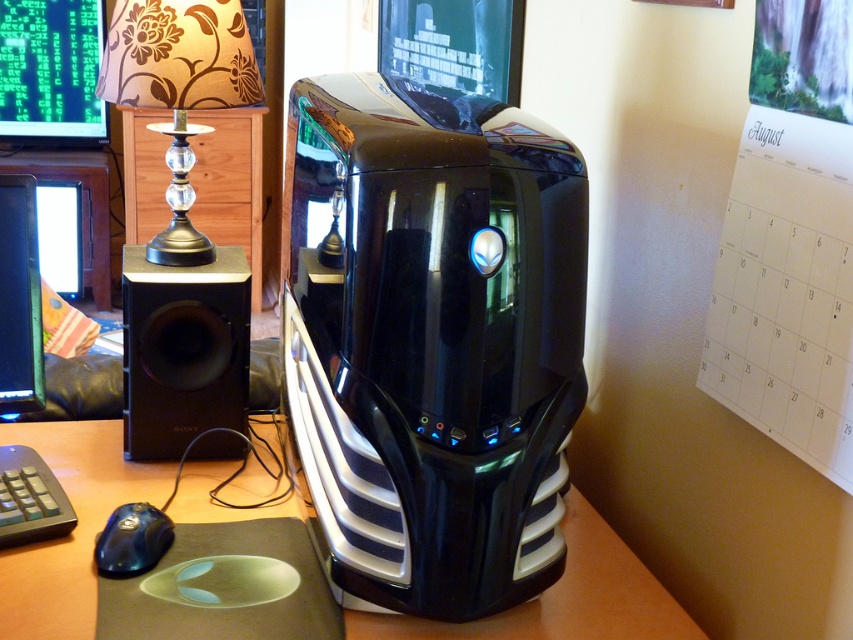
Which of these two, white paper calendar at upper right or black rubberized keyboard at lower left, stands shorter?

Standing shorter between the two is black rubberized keyboard at lower left.

Can you confirm if white paper calendar at upper right is positioned below black rubberized keyboard at lower left?

No.

Is point (747, 109) farther from viewer compared to point (47, 502)?

No, it is not.

Identify the location of white paper calendar at upper right. (786, 289).

Who is positioned more to the left, white paper calendar at upper right or blue glossy mouse at lower left?

Positioned to the left is blue glossy mouse at lower left.

This screenshot has width=853, height=640. Describe the element at coordinates (786, 289) in the screenshot. I see `white paper calendar at upper right` at that location.

Measure the distance between white paper calendar at upper right and camera.

white paper calendar at upper right and camera are 89.13 centimeters apart from each other.

You are a GUI agent. You are given a task and a screenshot of the screen. Output one action in this format:
    pyautogui.click(x=<x>, y=<y>)
    Task: Click on the white paper calendar at upper right
    This screenshot has width=853, height=640.
    Given the screenshot: What is the action you would take?
    pyautogui.click(x=786, y=289)

Which is in front, point (578, 230) or point (161, 390)?

Point (578, 230)

Between glossy black desktop at center and black matte speaker at left, which one has less height?

Standing shorter between the two is black matte speaker at left.

Where is `glossy black desktop at center`? This screenshot has height=640, width=853. glossy black desktop at center is located at coordinates (432, 339).

What are the coordinates of `glossy black desktop at center` in the screenshot? It's located at coord(432,339).